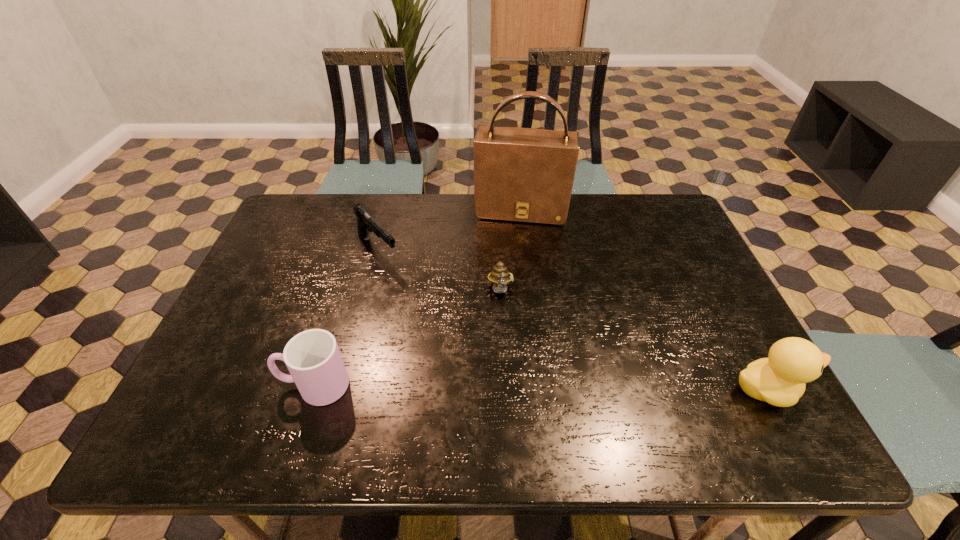
Locate an element on the screen. cup is located at coordinates (312, 357).

Where is `duck`? The height and width of the screenshot is (540, 960). duck is located at coordinates (780, 380).

This screenshot has height=540, width=960. I want to click on the fourth nearest object, so click(366, 223).

Find the location of a particular element. shoulder bag is located at coordinates (526, 175).

Locate an element on the screen. The image size is (960, 540). the tallest object is located at coordinates (526, 175).

This screenshot has height=540, width=960. What are the coordinates of `snail` in the screenshot? It's located at (500, 277).

Identify the location of vacant space located 0.070m with the handle on the side of the cup. This screenshot has height=540, width=960. (248, 386).

The height and width of the screenshot is (540, 960). What are the coordinates of `free space located 0.140m with the handle on the side of the cup` in the screenshot? It's located at (216, 386).

This screenshot has height=540, width=960. Find the location of `vacant space located 0.070m with the handle on the side of the cup`. vacant space located 0.070m with the handle on the side of the cup is located at coordinates (248, 386).

Identify the location of vacant region located 0.380m at the aiming end of the fourth nearest object. Image resolution: width=960 pixels, height=540 pixels. (471, 355).